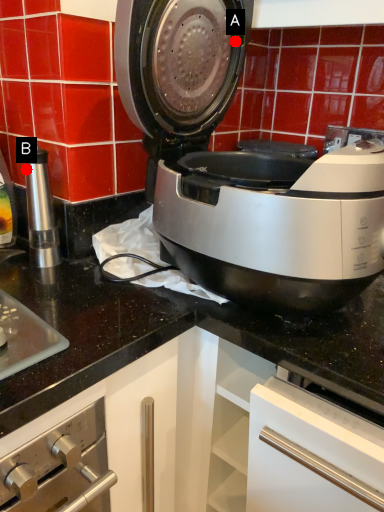
Question: Two points are circled on the image, labeled by A and B beside each circle. Which point is closer to the camera taking this photo?

Choices:
 (A) A is closer
 (B) B is closer

Answer: (A)